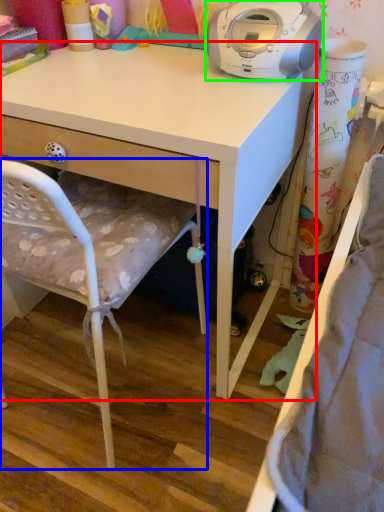
Question: Estimate the real-world distances between objects in this image. Which object is closer to desk (highlighted by a red box), chair (highlighted by a blue box) or home appliance (highlighted by a green box)?

Choices:
 (A) chair
 (B) home appliance

Answer: (A)